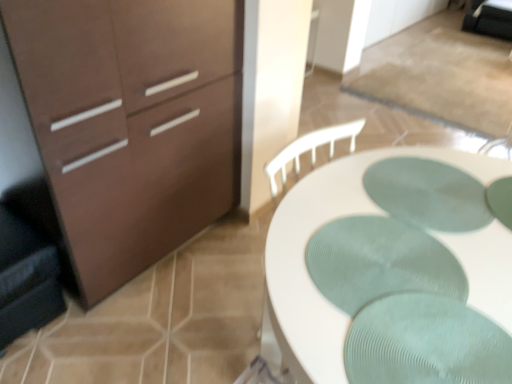
Find the location of a particular element. free space to the left of green textured placemat at center, marked as the 2th oval in a bottom-to-top arrangement is located at coordinates (330, 210).